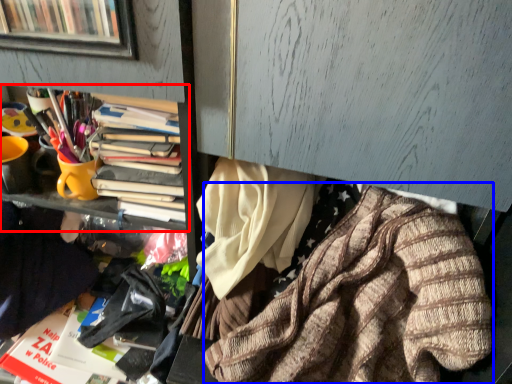
Question: Which object is further to the camera taking this photo, bookcase (highlighted by a red box) or clothing (highlighted by a blue box)?

Choices:
 (A) bookcase
 (B) clothing

Answer: (A)